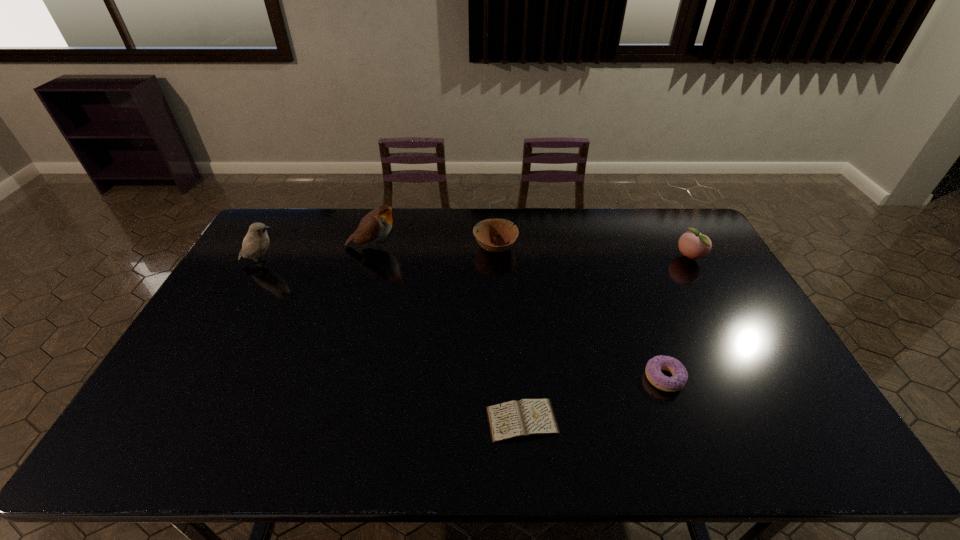
At what (x,y) coordinates should I click in order to perform the action: click on the nearest object. Please return your answer as a coordinate pair (x, y). Image resolution: width=960 pixels, height=540 pixels. Looking at the image, I should click on [x=525, y=418].

Image resolution: width=960 pixels, height=540 pixels. I want to click on free location located 0.100m at the face of the right bird, so click(x=430, y=246).

Identify the location of free space located 0.240m at the beak of the nearer bird. (354, 263).

I want to click on vacant space located 0.060m on the left of the peach, so click(x=658, y=258).

Identify the location of free location located on the back of the bowl. The width and height of the screenshot is (960, 540). (494, 214).

Where is `free space located on the back of the fifth farthest object`? The height and width of the screenshot is (540, 960). free space located on the back of the fifth farthest object is located at coordinates pyautogui.click(x=650, y=340).

Image resolution: width=960 pixels, height=540 pixels. Identify the location of vacant space located 0.230m on the right of the shortest object. (653, 420).

Image resolution: width=960 pixels, height=540 pixels. Identify the location of bird situated at the far edge. (376, 225).

Image resolution: width=960 pixels, height=540 pixels. I want to click on bowl present at the far edge, so click(486, 229).

Where is `object at the near edge`? The width and height of the screenshot is (960, 540). object at the near edge is located at coordinates (525, 418).